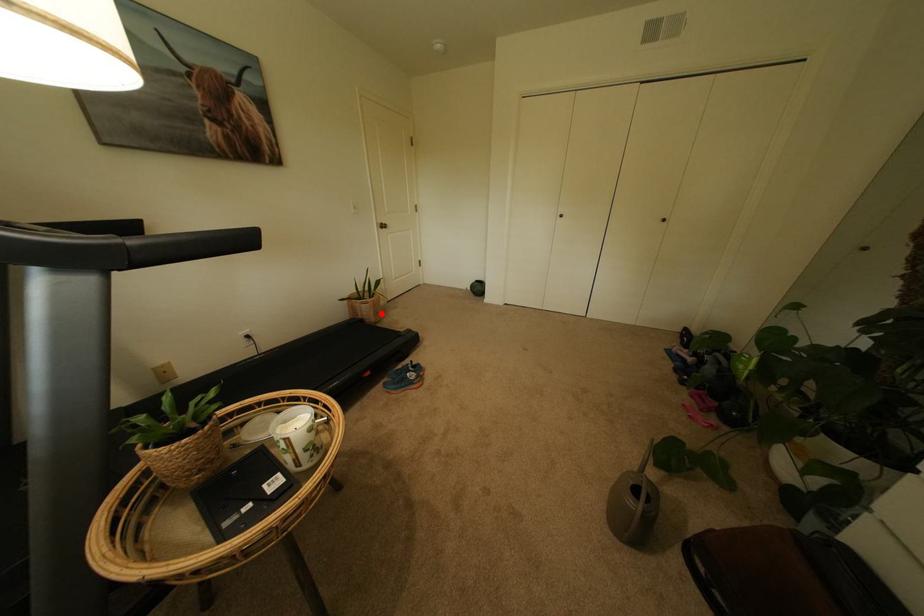
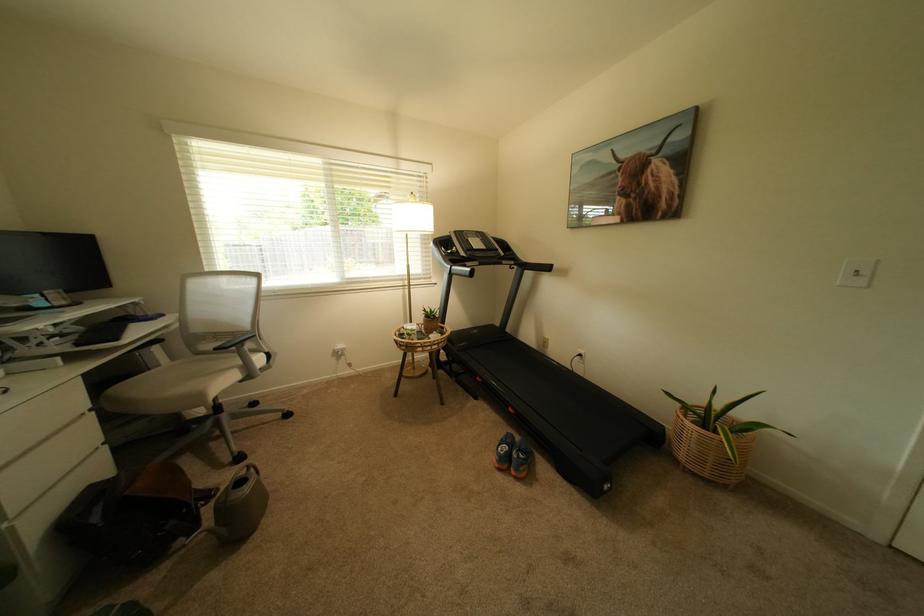
Where in the second image is the point corresponding to the highlighted location from the first image?

(695, 448)